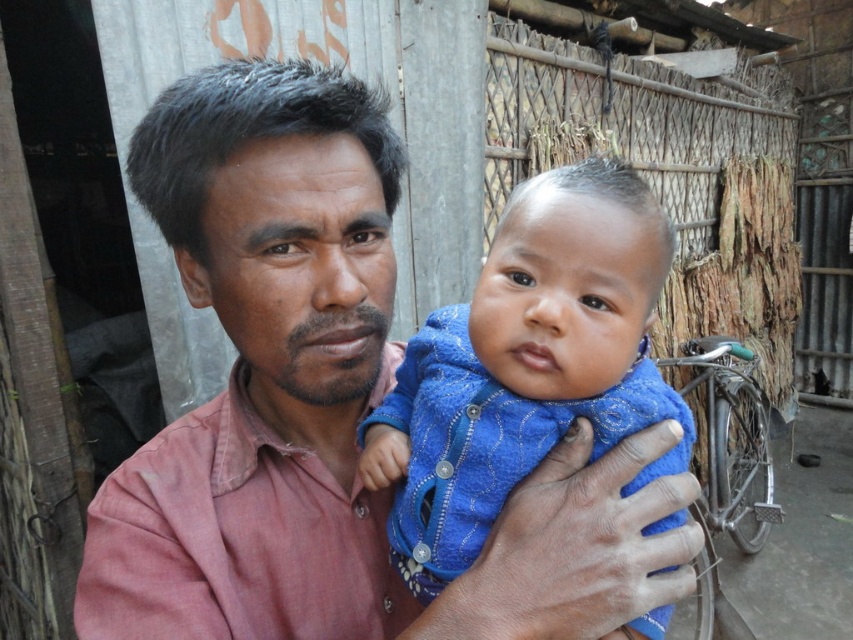
Question: Which of the following is the closest to the observer?

Choices:
 (A) blue textured cloth at center
 (B) pink cotton shirt at center

Answer: (B)

Question: Is pink cotton shirt at center below blue textured cloth at center?

Choices:
 (A) yes
 (B) no

Answer: (A)

Question: From the image, what is the correct spatial relationship of pink cotton shirt at center in relation to blue textured cloth at center?

Choices:
 (A) below
 (B) above

Answer: (A)

Question: Which object appears farthest from the camera in this image?

Choices:
 (A) pink cotton shirt at center
 (B) blue textured cloth at center

Answer: (B)

Question: Can you confirm if pink cotton shirt at center is positioned below blue textured cloth at center?

Choices:
 (A) no
 (B) yes

Answer: (B)